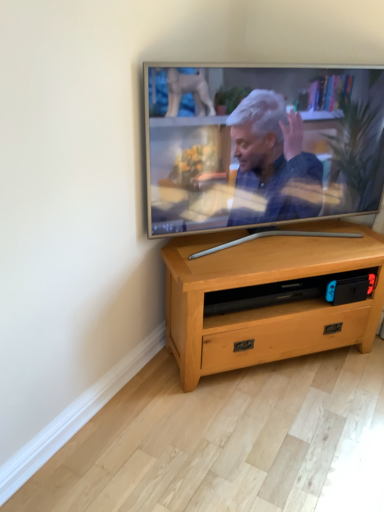
The height and width of the screenshot is (512, 384). In order to click on free space in front of light wood/texture tv stand at center in this screenshot , I will do `click(275, 432)`.